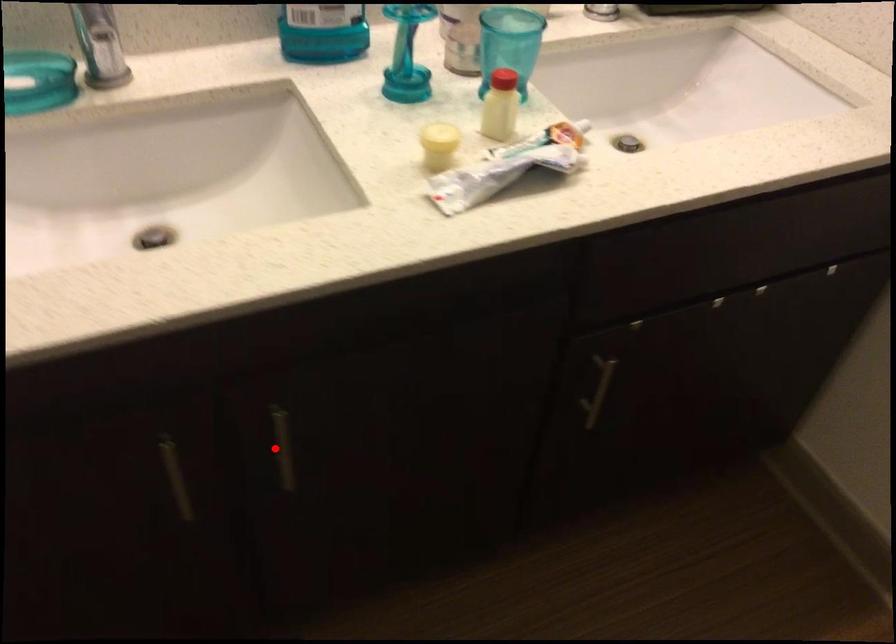
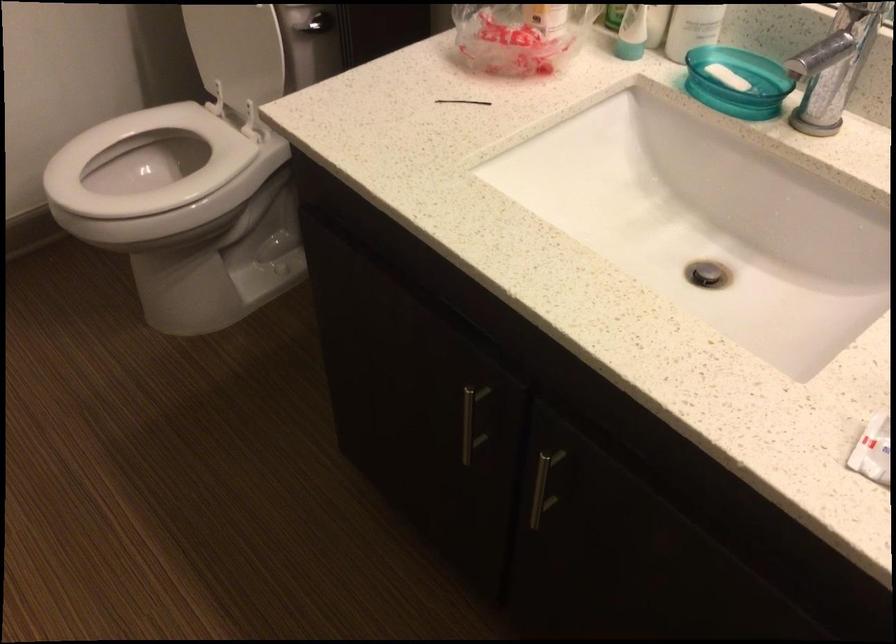
Find the pixel in the second image that matches the highlighted location in the first image.

(543, 486)